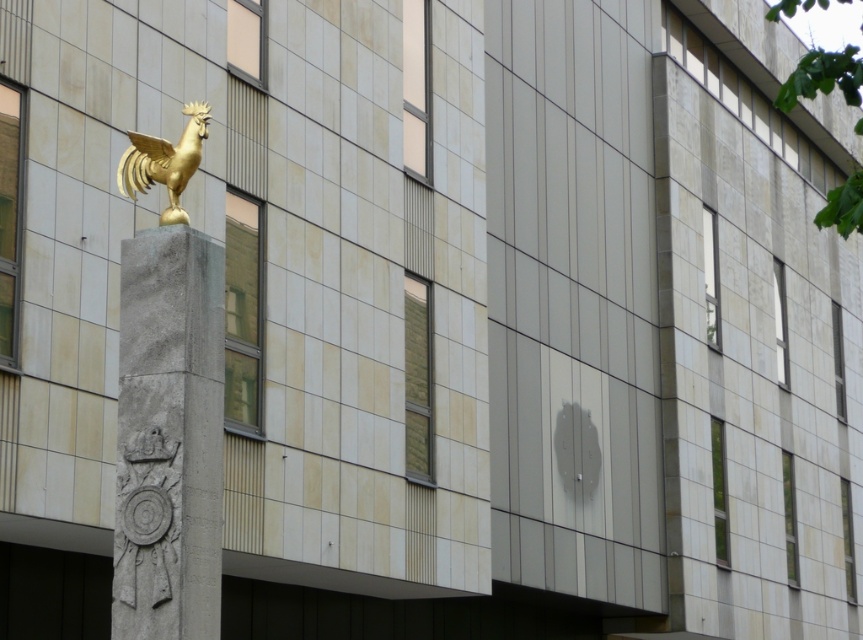
Between gray stone column at center and gold metallic rooster at upper left, which one appears on the left side from the viewer's perspective?

From the viewer's perspective, gold metallic rooster at upper left appears more on the left side.

Who is positioned more to the right, gray stone column at center or gold metallic rooster at upper left?

From the viewer's perspective, gray stone column at center appears more on the right side.

Who is more forward, (213,307) or (149,182)?

Positioned in front is point (213,307).

Identify the location of gray stone column at center. The width and height of the screenshot is (863, 640). (169, 436).